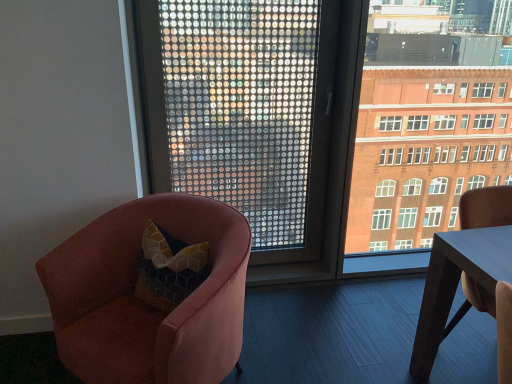
This screenshot has width=512, height=384. I want to click on free region under smooth wooden table at right (from a real-world perspective), so pos(471,344).